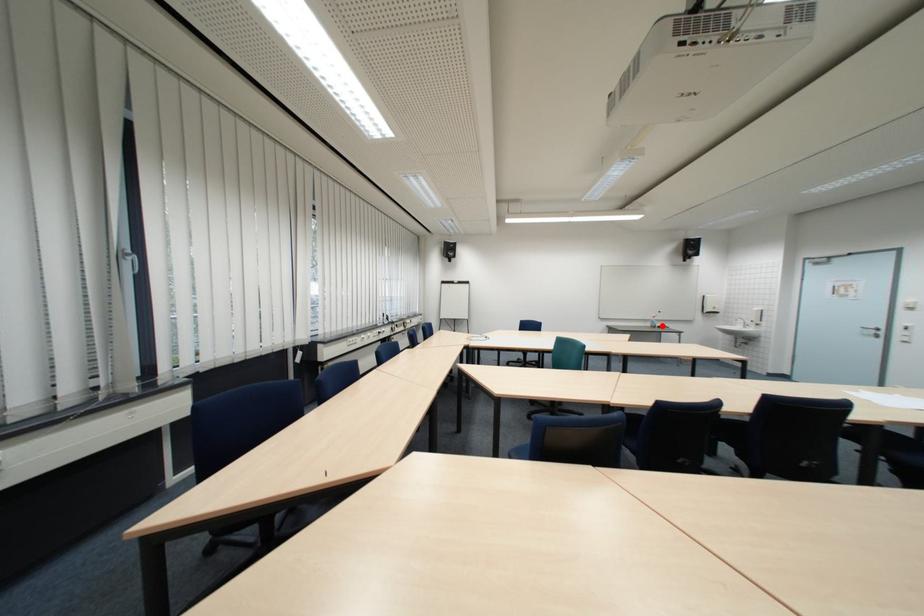
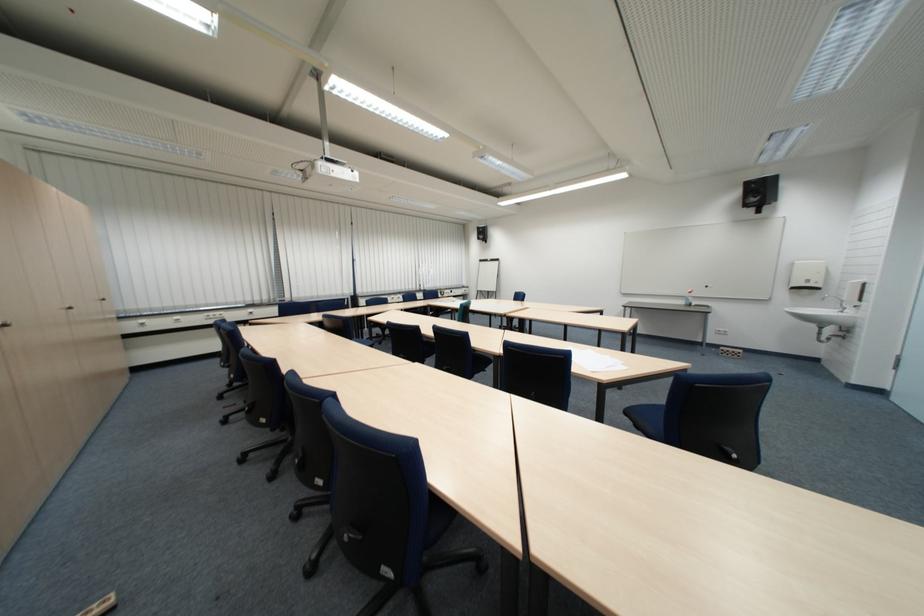
In the second image, find the point that corresponds to the highlighted location in the first image.

(696, 302)